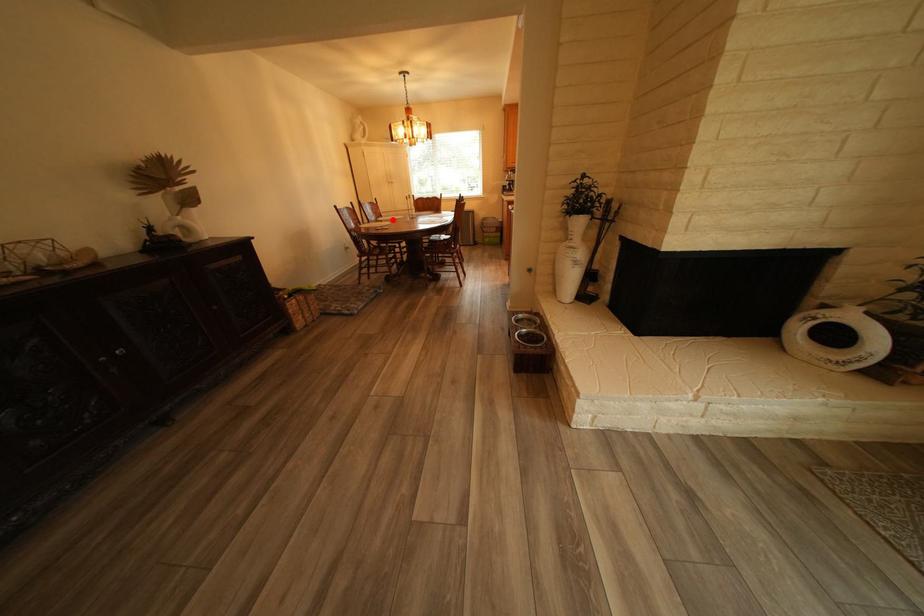
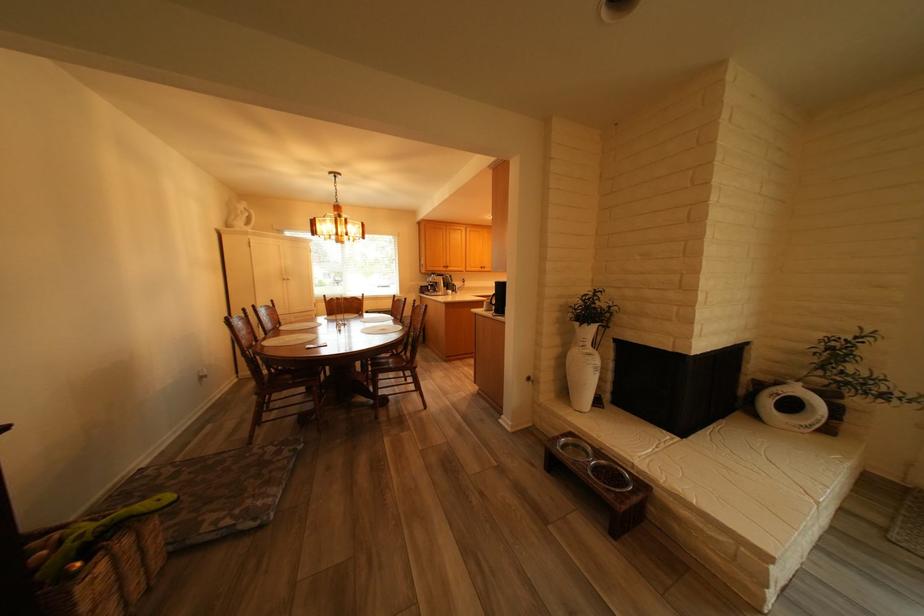
Question: A red point is marked in image1. In image2, is the corresponding 3D point closer to the camera or farther? Reply with the corresponding letter.

Choices:
 (A) The corresponding 3D point is closer.
 (B) The corresponding 3D point is farther.

Answer: (B)